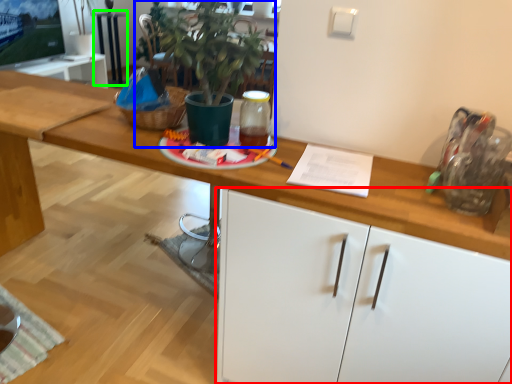
Question: Which is nearer to the cabinetry (highlighted by a red box)? houseplant (highlighted by a blue box) or table (highlighted by a green box).

Choices:
 (A) houseplant
 (B) table

Answer: (A)